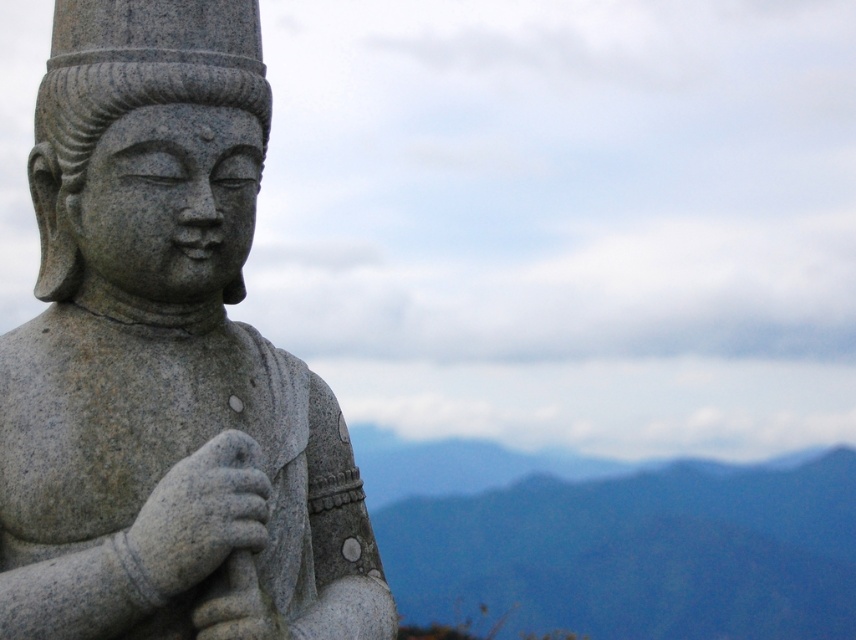
Question: Does granite statue at left have a greater width compared to blue-green textured mountain at lower right?

Choices:
 (A) no
 (B) yes

Answer: (A)

Question: Which of the following is the closest to the observer?

Choices:
 (A) blue-green textured mountain at lower right
 (B) granite statue at left

Answer: (B)

Question: Which point appears farthest from the camera in this image?

Choices:
 (A) (515, 492)
 (B) (164, 445)

Answer: (A)

Question: Does granite statue at left come behind blue-green textured mountain at lower right?

Choices:
 (A) no
 (B) yes

Answer: (A)

Question: In this image, where is granite statue at left located relative to blue-green textured mountain at lower right?

Choices:
 (A) right
 (B) left

Answer: (B)